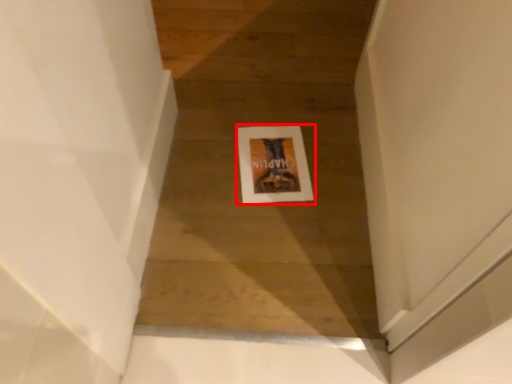
Question: From the image, what is the correct spatial relationship of picture frame (annotated by the red box) in relation to stairwell?

Choices:
 (A) left
 (B) right

Answer: (B)